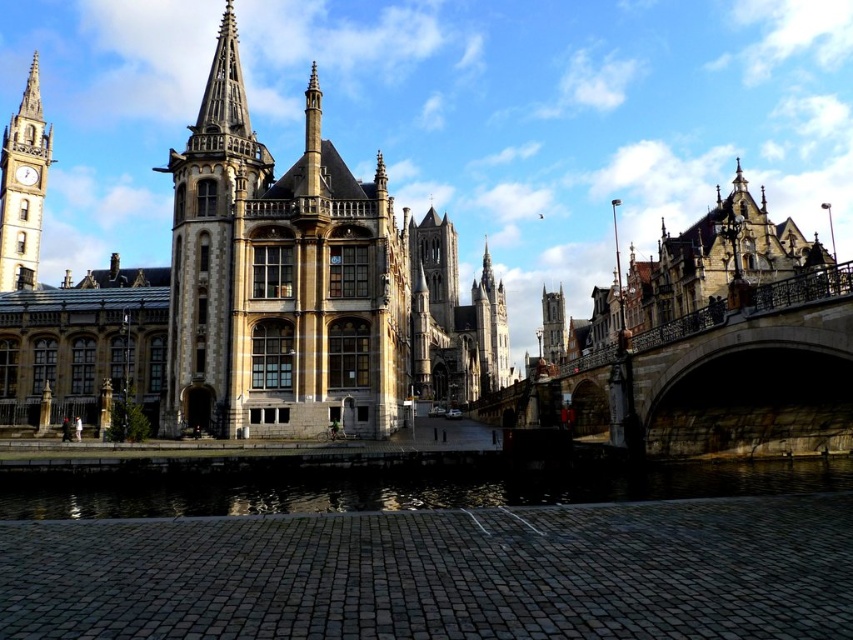
Does dark stone bridge at right appear on the left side of golden stone spire at center?

Incorrect, dark stone bridge at right is not on the left side of golden stone spire at center.

Identify the location of dark stone bridge at right. Image resolution: width=853 pixels, height=640 pixels. (714, 380).

Which is more to the left, stone steeple at center or golden stone spire at center?

stone steeple at center

Does point (219, 326) lie behind point (500, 339)?

No, (219, 326) is closer to viewer.

In order to click on stone steeple at center in this screenshot , I will do pyautogui.click(x=210, y=248).

Between point (223, 182) and point (554, 291), which one is positioned behind?

The point (554, 291) is behind.

Does stone gothic palace at center appear on the left side of smooth stone tower at center?

Indeed, stone gothic palace at center is positioned on the left side of smooth stone tower at center.

Describe the element at coordinates (239, 289) in the screenshot. This screenshot has width=853, height=640. I see `stone gothic palace at center` at that location.

Locate an element on the screen. stone gothic palace at center is located at coordinates (239, 289).